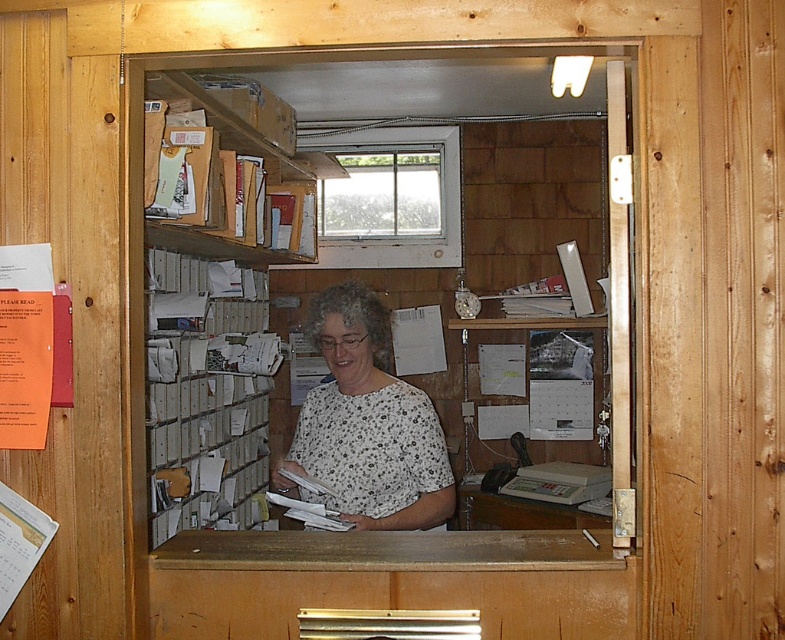
Does point (181, 394) come closer to viewer compared to point (329, 316)?

No, it is behind (329, 316).

Is the position of wooden shelves at left more distant than that of white dotted blouse at center?

No, it is not.

Is point (232, 472) in front of point (362, 340)?

No, (232, 472) is behind (362, 340).

Where is `wooden shelves at left`? wooden shelves at left is located at coordinates (217, 301).

Does clear glass window at upper center come in front of wooden shelves at upper left?

That is False.

Looking at this image, between clear glass window at upper center and wooden shelves at upper left, which one is positioned higher?

wooden shelves at upper left is higher up.

Describe the element at coordinates (382, 195) in the screenshot. The image size is (785, 640). I see `clear glass window at upper center` at that location.

Where is `clear glass window at upper center`? clear glass window at upper center is located at coordinates (382, 195).

Between wooden shelves at left and white wooden window at upper center, which one appears on the left side from the viewer's perspective?

wooden shelves at left is more to the left.

Find the location of a particular element. The height and width of the screenshot is (640, 785). wooden shelves at left is located at coordinates click(x=217, y=301).